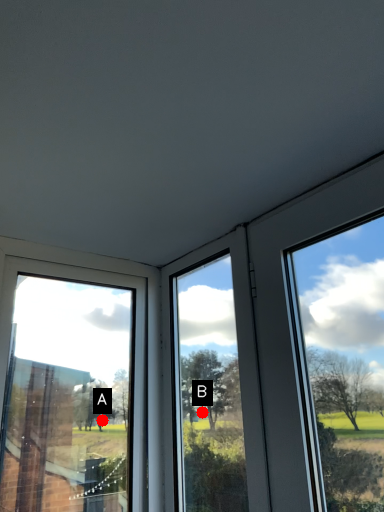
Question: Two points are circled on the image, labeled by A and B beside each circle. Which point is farther to the camera?

Choices:
 (A) A is further
 (B) B is further

Answer: (A)